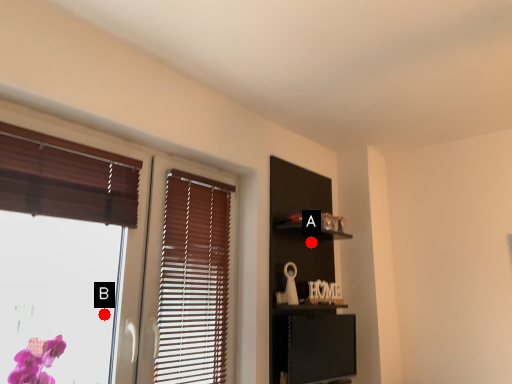
Question: Two points are circled on the image, labeled by A and B beside each circle. Among these points, which one is nearest to the camera?

Choices:
 (A) A is closer
 (B) B is closer

Answer: (B)